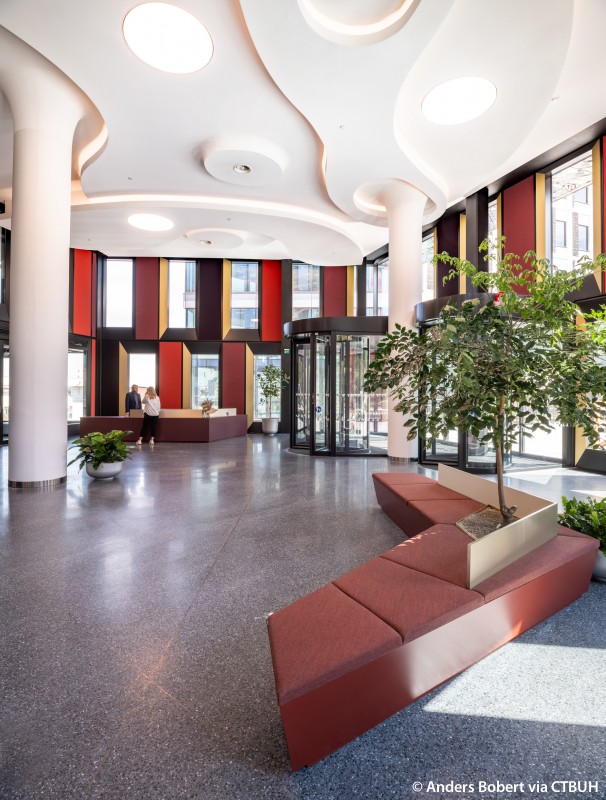
You are a GUI agent. You are given a task and a screenshot of the screen. Output one action in this format:
    pyautogui.click(x=<x>, y=<y>)
    Task: Click on the door
    The image size is (606, 800).
    Given the screenshot: What is the action you would take?
    pyautogui.click(x=353, y=397), pyautogui.click(x=303, y=392)